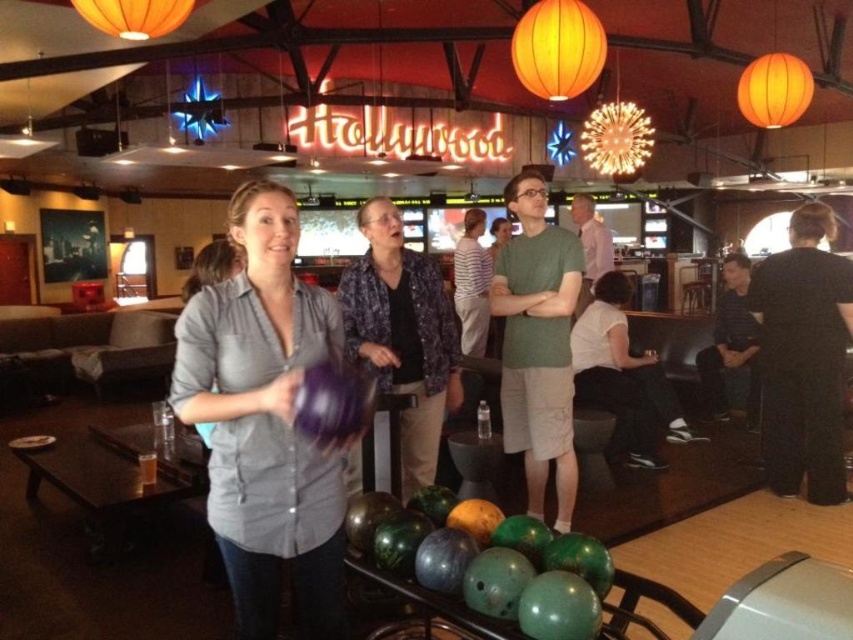
Is point (260, 444) positioned in front of point (432, 268)?

Yes, it is.

Who is positioned more to the right, matte gray shirt at center or purple floral shirt at center?

purple floral shirt at center is more to the right.

Find the location of `matte gray shirt at center`. matte gray shirt at center is located at coordinates (265, 420).